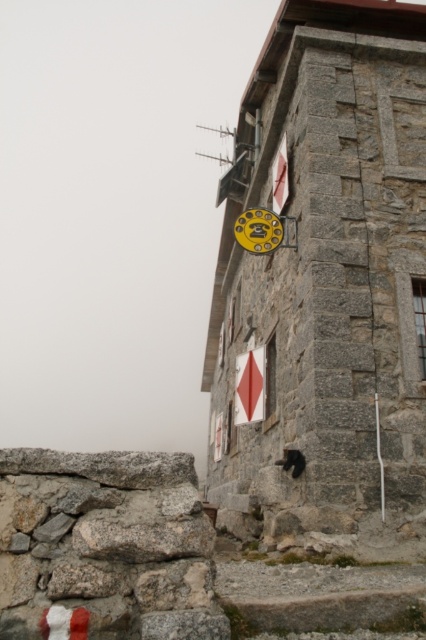
Question: Which of the following is the closest to the observer?

Choices:
 (A) white matte sign at upper center
 (B) stone textured tower at center
 (C) gray rough stone at lower left

Answer: (C)

Question: Is gray rough stone at lower left bigger than white matte sign at upper center?

Choices:
 (A) yes
 (B) no

Answer: (A)

Question: Is the position of red plastic diamond at center less distant than that of white matte sign at upper center?

Choices:
 (A) yes
 (B) no

Answer: (B)

Question: Based on their relative distances, which object is nearer to the white matte sign at upper center?

Choices:
 (A) gray rough stone at lower left
 (B) red plastic diamond at center

Answer: (B)

Question: Observing the image, what is the correct spatial positioning of stone textured tower at center in reference to gray rough stone at lower left?

Choices:
 (A) above
 (B) below

Answer: (A)

Question: Which of these objects is positioned farthest from the red plastic diamond at center?

Choices:
 (A) white matte sign at upper center
 (B) gray rough stone at lower left
 (C) stone textured tower at center

Answer: (B)